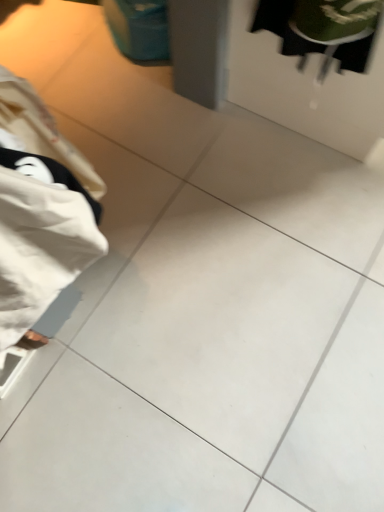
This screenshot has width=384, height=512. Identify the location of vacant area situated below white fabric at left (from a real-world perspective). (103, 325).